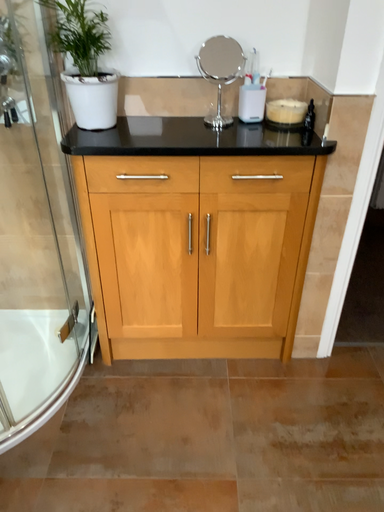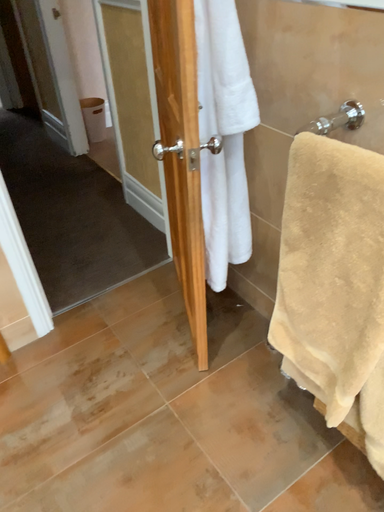
Question: Which way did the camera rotate in the video?

Choices:
 (A) rotated right
 (B) rotated left

Answer: (A)